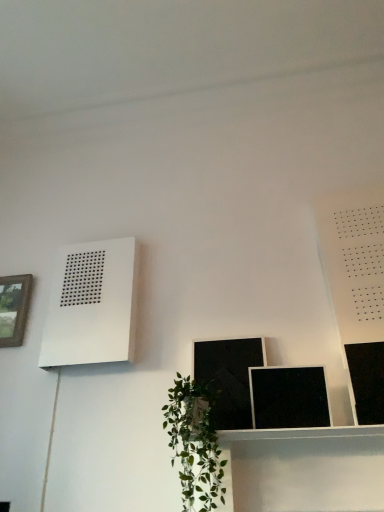
Question: From the image's perspective, would you say matte black picture frame at lower center, the 2th picture frame viewed from the back, is positioned over wooden framed picture at left, the first picture frame in the back-to-front sequence?

Choices:
 (A) no
 (B) yes

Answer: (A)

Question: Is matte black picture frame at lower center, the 2th picture frame viewed from the back, turned away from wooden framed picture at left, the 4th picture frame when ordered from right to left?

Choices:
 (A) yes
 (B) no

Answer: (B)

Question: Can you confirm if matte black picture frame at lower center, which ranks as the second picture frame in left-to-right order, is taller than wooden framed picture at left, the first picture frame positioned from the left?

Choices:
 (A) yes
 (B) no

Answer: (A)

Question: Is matte black picture frame at lower center, acting as the third picture frame starting from the front, outside wooden framed picture at left, which is the fourth picture frame in front-to-back order?

Choices:
 (A) no
 (B) yes

Answer: (B)

Question: From a real-world perspective, is matte black picture frame at lower center, acting as the third picture frame starting from the front, located beneath wooden framed picture at left, which is the fourth picture frame in front-to-back order?

Choices:
 (A) yes
 (B) no

Answer: (A)

Question: Considering the relative positions of matte black picture frame at lower center, which ranks as the second picture frame in left-to-right order, and wooden framed picture at left, the first picture frame positioned from the left, in the image provided, is matte black picture frame at lower center, which ranks as the second picture frame in left-to-right order, behind wooden framed picture at left, the first picture frame positioned from the left,?

Choices:
 (A) yes
 (B) no

Answer: (B)

Question: Does green leafy plant at lower center have a lesser height compared to matte black picture frame at lower center, which ranks as the second picture frame in left-to-right order?

Choices:
 (A) yes
 (B) no

Answer: (B)

Question: Is green leafy plant at lower center placed right next to matte black picture frame at lower center, the third picture frame when ordered from right to left?

Choices:
 (A) no
 (B) yes

Answer: (A)

Question: From a real-world perspective, is green leafy plant at lower center physically above matte black picture frame at lower center, which ranks as the second picture frame in left-to-right order?

Choices:
 (A) no
 (B) yes

Answer: (A)

Question: Is green leafy plant at lower center aimed at matte black picture frame at lower center, the third picture frame when ordered from right to left?

Choices:
 (A) yes
 (B) no

Answer: (B)

Question: Is matte black picture frame at lower center, which ranks as the second picture frame in left-to-right order, at the back of green leafy plant at lower center?

Choices:
 (A) no
 (B) yes

Answer: (A)

Question: Considering the relative sizes of green leafy plant at lower center and matte black picture frame at lower center, the 2th picture frame viewed from the back, in the image provided, is green leafy plant at lower center smaller than matte black picture frame at lower center, the 2th picture frame viewed from the back,?

Choices:
 (A) yes
 (B) no

Answer: (B)

Question: Does black matte picture frame at lower center, which is counted as the 3th picture frame, starting from the left, lie behind white matte air conditioner at upper left?

Choices:
 (A) yes
 (B) no

Answer: (B)